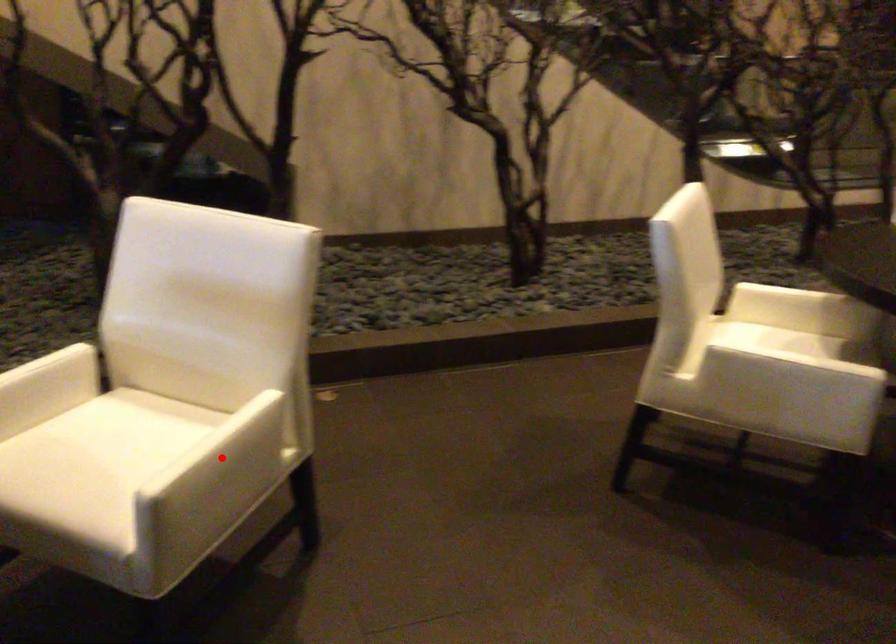
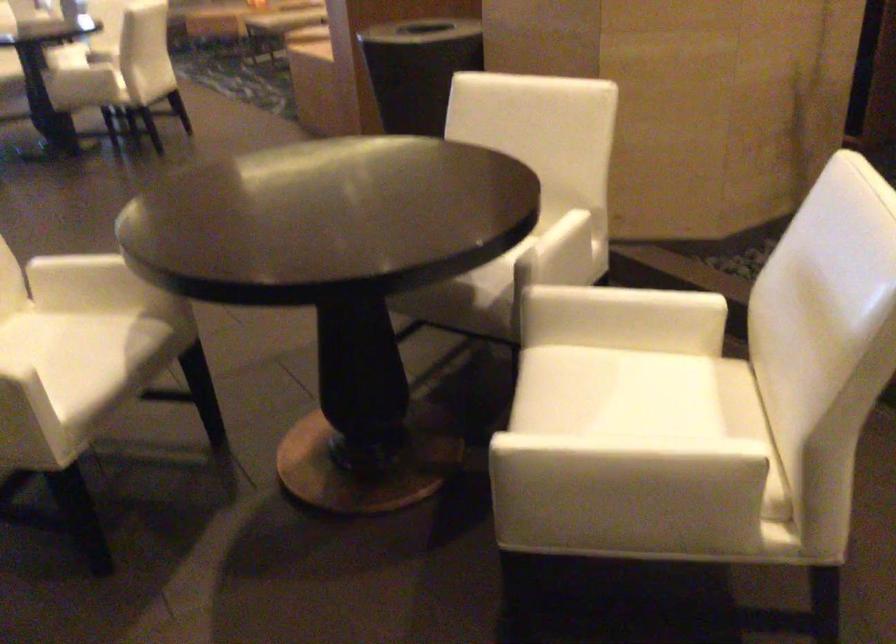
In the second image, find the point that corresponds to the highlighted location in the first image.

(607, 462)